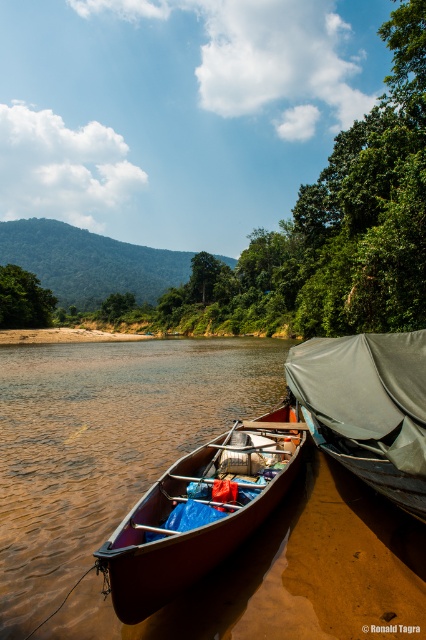
You are standing on the riverside and want to take a photo of both the wooden canoe at center and the dark gray tarpaulin boat at right. Which object will appear larger in your photo?

The wooden canoe at center will appear larger in the photo because it is closer to the viewer than the dark gray tarpaulin boat at right.